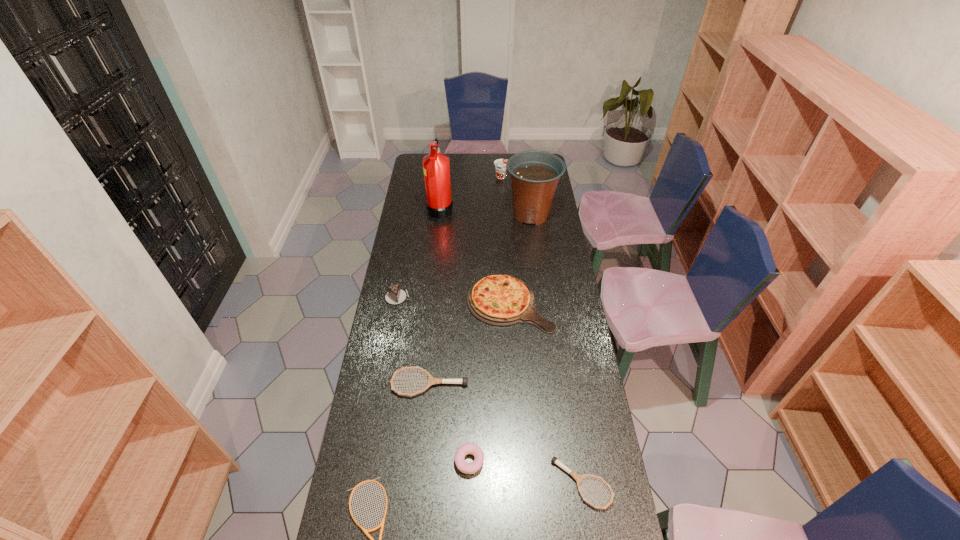
Find the location of a particular element. the left gray tennis racket is located at coordinates (431, 380).

The width and height of the screenshot is (960, 540). In order to click on the smaller gray tennis racket in this screenshot , I will do `click(577, 477)`.

Identify the location of the nearer gray tennis racket. (577, 477).

I want to click on vacant space located 0.400m at the spray nozzle of the fire extinguisher, so click(530, 208).

Locate an element on the screen. free space located on the front of the second tallest object is located at coordinates (536, 247).

Where is `vacant region located on the front of the yogurt`? This screenshot has height=540, width=960. vacant region located on the front of the yogurt is located at coordinates (504, 207).

Locate an element on the screen. The height and width of the screenshot is (540, 960). vacant space located on the front of the chocolate cake is located at coordinates (383, 380).

You are a GUI agent. You are given a task and a screenshot of the screen. Output one action in this format:
    pyautogui.click(x=<x>, y=<y>)
    Task: Click on the vacant space situated on the back of the red pizza
    The width and height of the screenshot is (960, 540).
    Given the screenshot: What is the action you would take?
    pyautogui.click(x=505, y=233)

I want to click on blank space located 0.110m on the back of the purple doughnut, so click(470, 414).

Identify the location of free region located on the right of the bigger gray tennis racket. This screenshot has height=540, width=960. (554, 383).